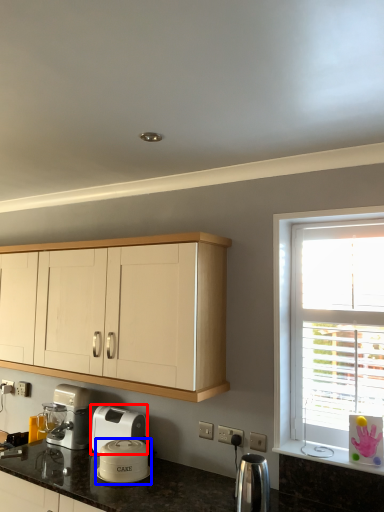
Question: Which of the following is the farthest to the observer, home appliance (highlighted by a red box) or kitchen appliance (highlighted by a blue box)?

Choices:
 (A) home appliance
 (B) kitchen appliance

Answer: (A)